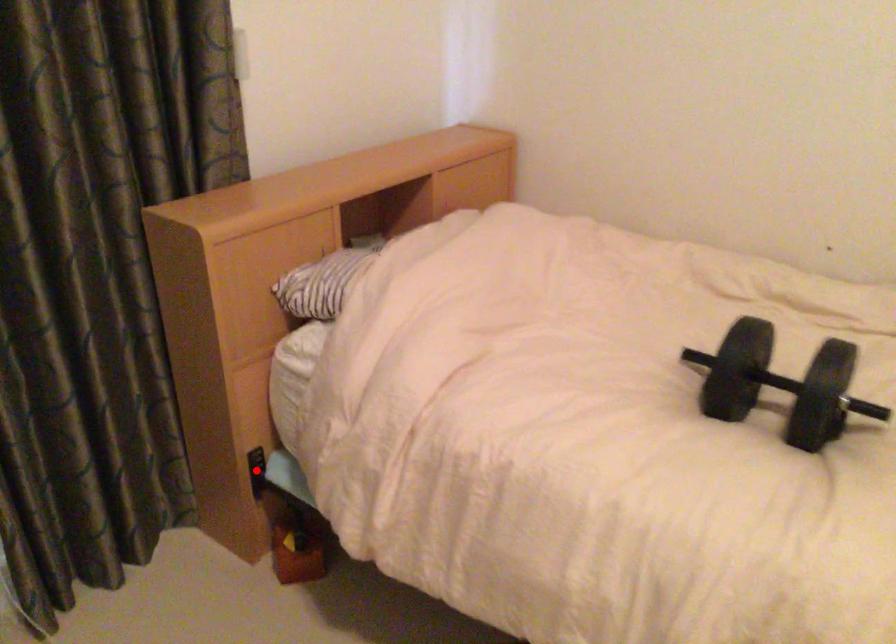
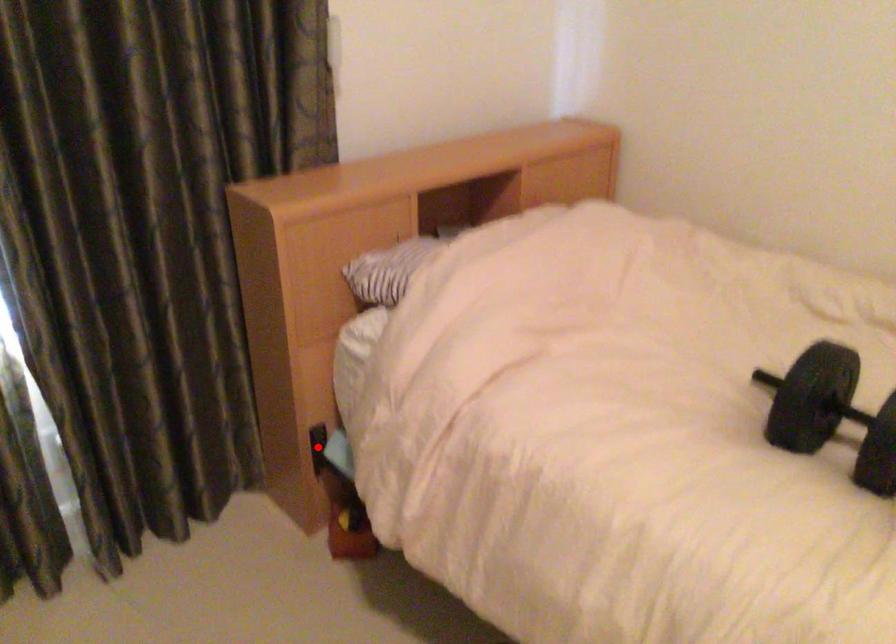
I am providing you with two images of the same scene from different viewpoints. A red point is marked on the first image and another point is marked on the second image. Is the red point in image1 aligned with the point shown in image2?

Yes